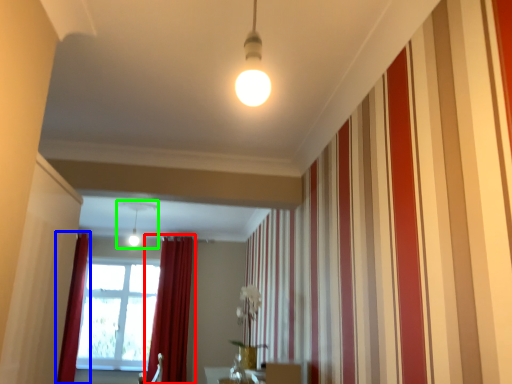
Question: Which object is positioned closest to curtain (highlighted by a red box)? Select from curtain (highlighted by a blue box) and light fixture (highlighted by a green box).

Choices:
 (A) curtain
 (B) light fixture

Answer: (A)